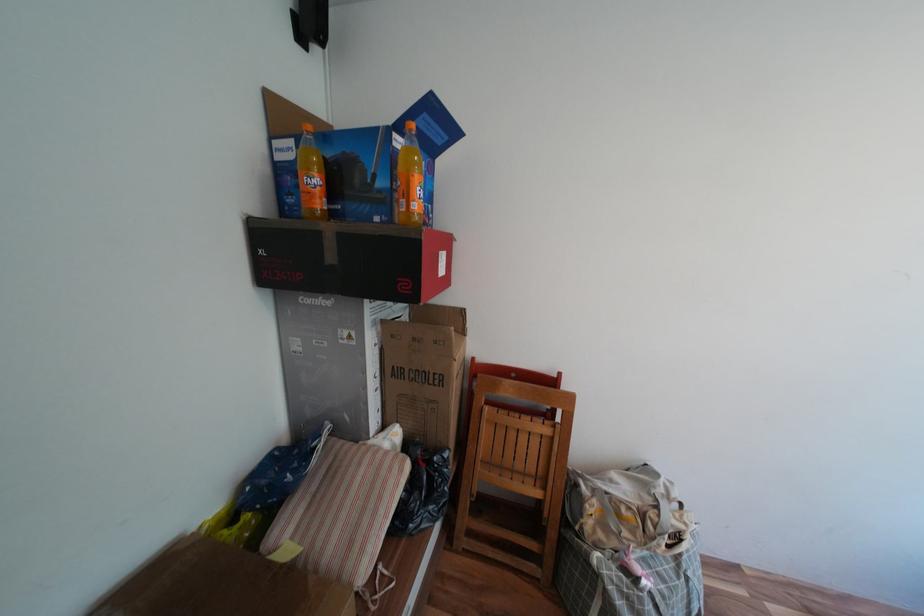
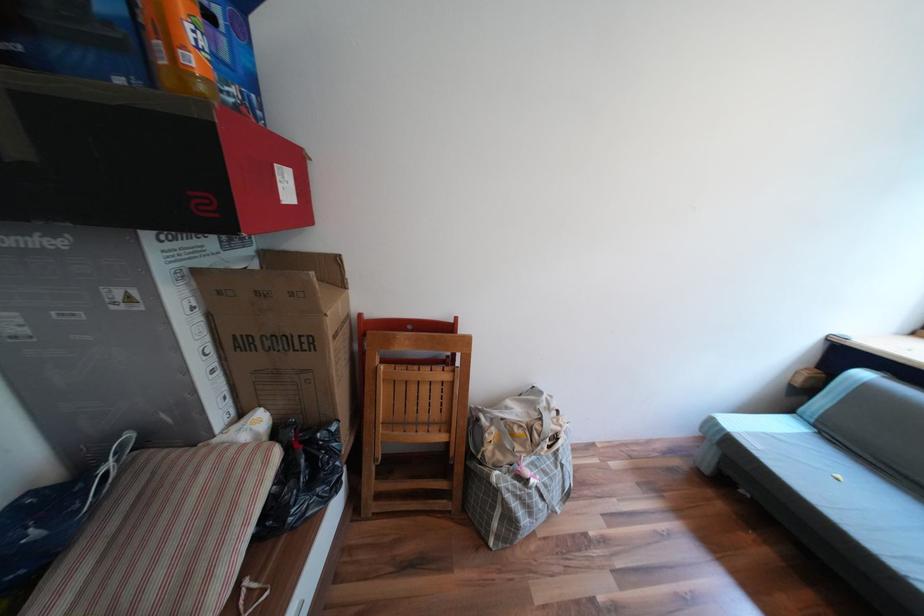
Where in the second image is the point corresponding to [444,458] from the first image?

(327, 435)